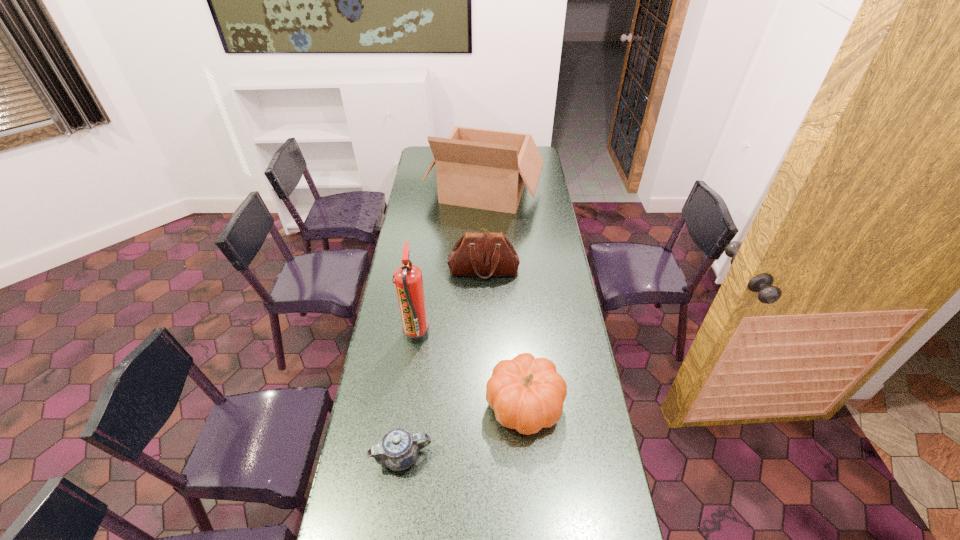
I want to click on blank space located from the spout of the shortest object, so click(558, 456).

Identify the location of object at the far edge. This screenshot has height=540, width=960. (486, 169).

Where is `box that is at the left edge`? box that is at the left edge is located at coordinates (486, 169).

Identify the location of fire extinguisher positioned at the left edge. Image resolution: width=960 pixels, height=540 pixels. (408, 278).

Where is `chinaware at the left edge`? This screenshot has height=540, width=960. chinaware at the left edge is located at coordinates (398, 449).

The height and width of the screenshot is (540, 960). What are the coordinates of `box situated at the right edge` in the screenshot? It's located at (486, 169).

The image size is (960, 540). What are the coordinates of `pumpkin that is at the right edge` in the screenshot? It's located at (527, 394).

Locate an element on the screen. Image resolution: width=960 pixels, height=540 pixels. object present at the far left corner is located at coordinates (486, 169).

Where is `object that is at the far right corner`? The image size is (960, 540). object that is at the far right corner is located at coordinates (486, 169).

What are the coordinates of `free region at the left edge` in the screenshot? It's located at 400,244.